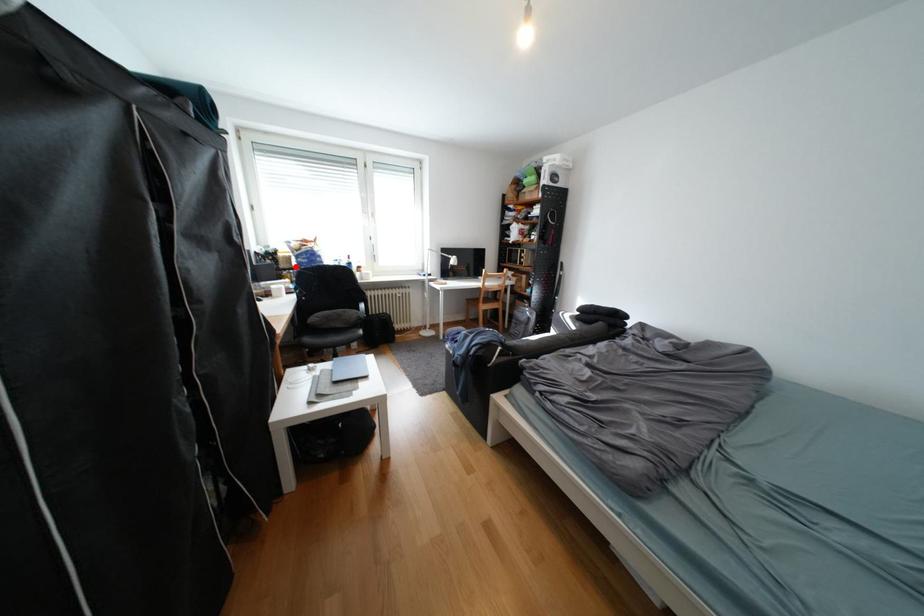
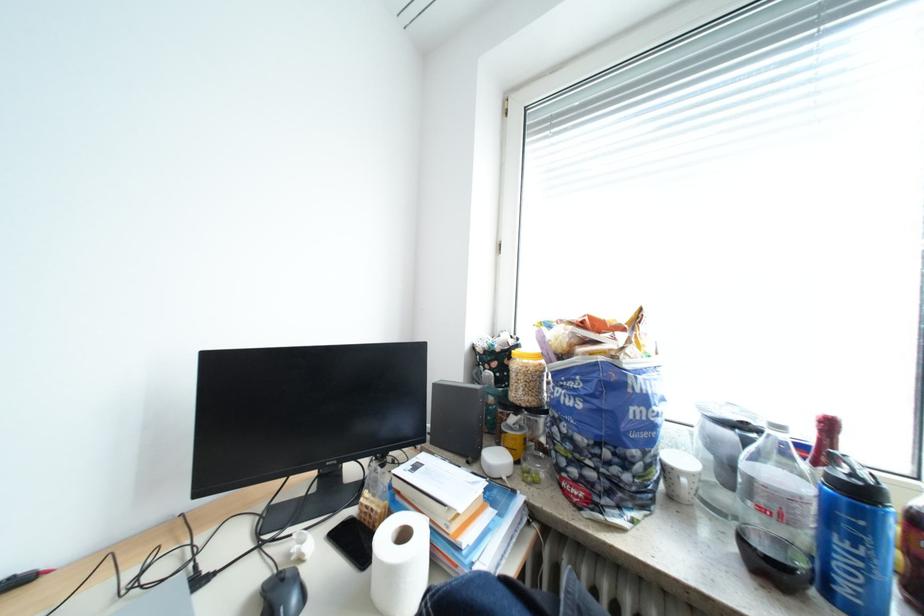
Locate, in the second image, the point that corresponds to the highlighted location in the first image.

(529, 394)